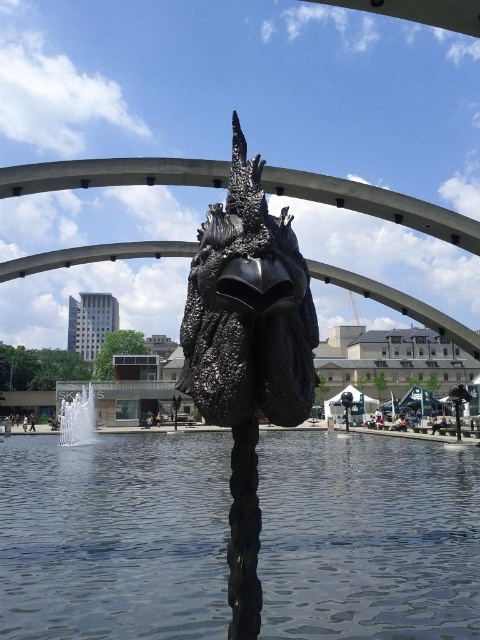
Who is more forward, (x=479, y=620) or (x=255, y=436)?

Point (x=255, y=436) is in front.

At what (x,y) coordinates should I click in order to perform the action: click on transparent glass water at center. Please return your answer as a coordinate pair (x, y). Looking at the image, I should click on (113, 538).

Is black textured sculpture at center in front of white glossy water at center?

That is True.

Is point (255, 577) in front of point (82, 385)?

Yes, it is in front of point (82, 385).

Who is more distant from viewer, (x=257, y=605) or (x=82, y=429)?

The point (x=82, y=429) is behind.

Where is `black textured sculpture at center`? black textured sculpture at center is located at coordinates (248, 349).

Is transparent glass water at center to the left of white glossy water at center from the viewer's perspective?

In fact, transparent glass water at center is to the right of white glossy water at center.

Consider the image. Is transparent glass water at center taller than white glossy water at center?

Correct, transparent glass water at center is much taller as white glossy water at center.

You are a GUI agent. You are given a task and a screenshot of the screen. Output one action in this format:
    pyautogui.click(x=<x>, y=<y>)
    Task: Click on the transparent glass water at center
    
    Given the screenshot: What is the action you would take?
    click(113, 538)

Image resolution: width=480 pixels, height=640 pixels. In order to click on transparent glass water at center in this screenshot , I will do `click(113, 538)`.